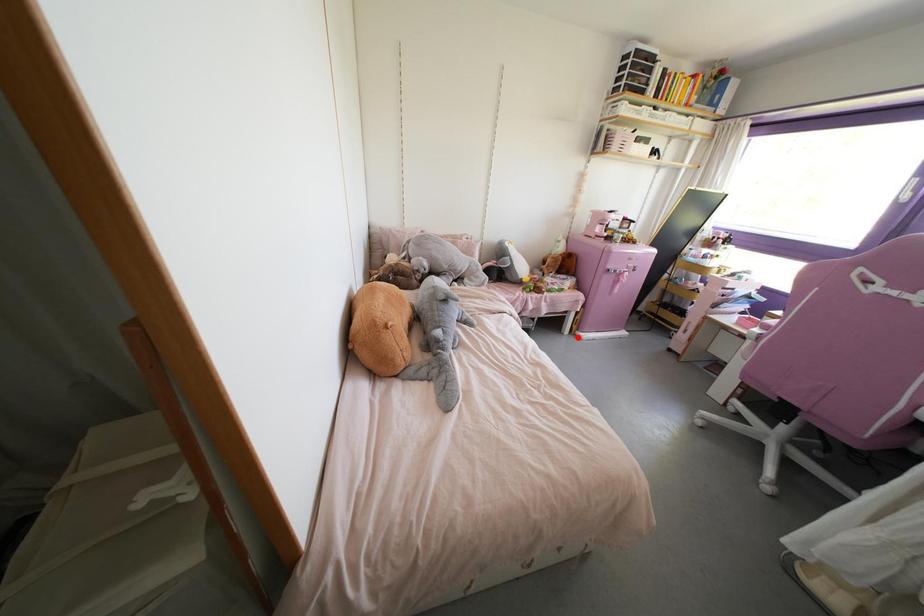
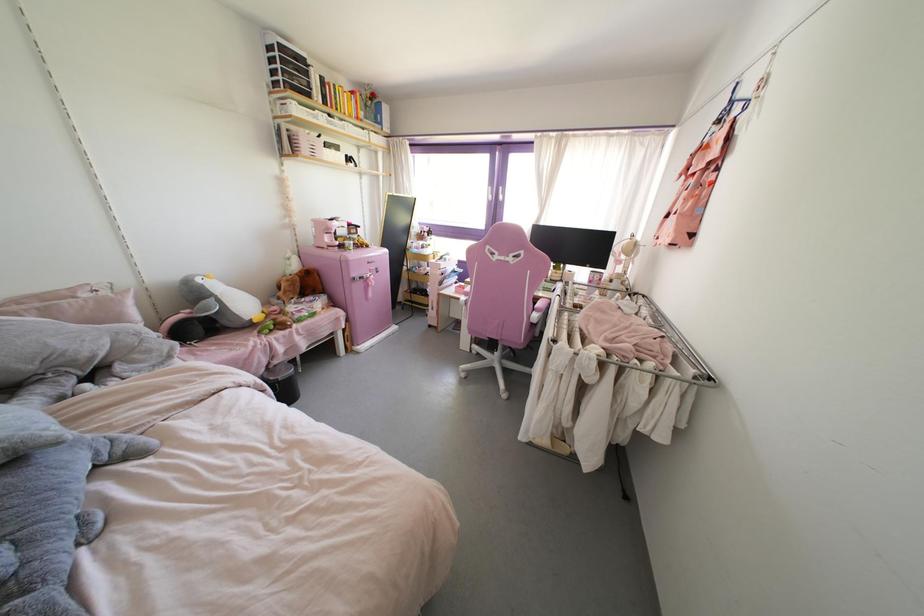
Where in the second image is the point corresponding to the highlighted location from the first image?

(357, 352)